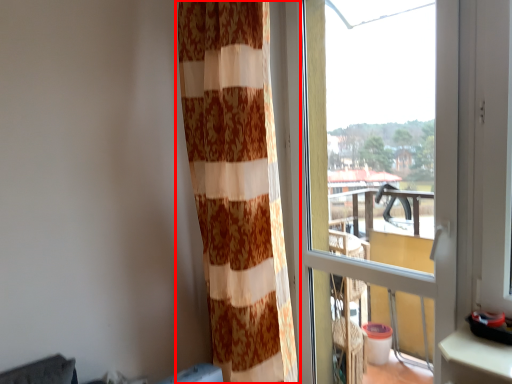
Question: From the image's perspective, what is the correct spatial positioning of curtain (annotated by the red box) in reference to window?

Choices:
 (A) above
 (B) below

Answer: (A)